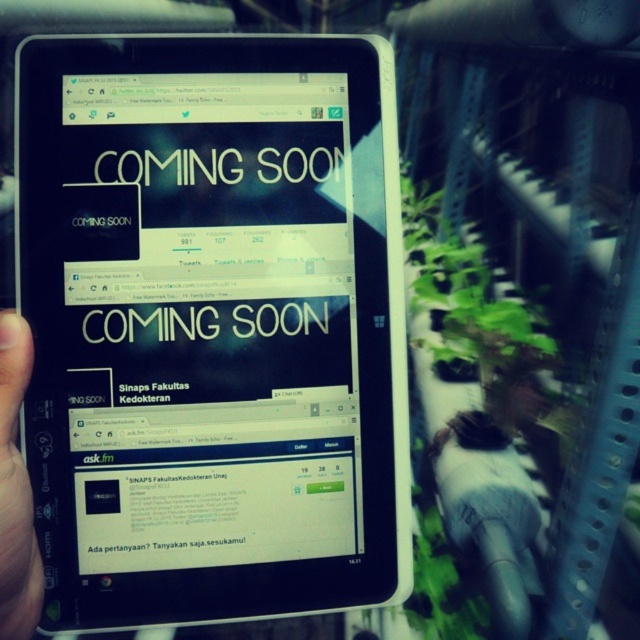
From the picture: You are a student trying to view both the black glossy tablet at center and the black matte tablet at left. Which tablet should you move closer to in order to see the details better?

You should move closer to the black glossy tablet at center because it is already closer to you than the black matte tablet at left, so it will be easier to see the details without straining.

You are a student trying to access the Sinaps Faculty of Medicine website on your black glossy tablet at center. The tablet is positioned at point coordinates of [212,324]. If you move your hand 0.1 units to the right from the tablet, will you be pointing towards the plants in the greenhouse background?

The point coordinates of [212,324] correspond to the black glossy tablet at center. Moving 0.1 units to the right would place your hand at approximately 0.609, 0.333. Since the plants in the greenhouse background are located to the right of the tablet, moving your hand 0.1 units to the right would indeed point towards the plants in the greenhouse background.

You are organizing a presentation about the Sinaps Faculty of Medicine. You have two tablets in the image, a black glossy tablet at center and a black matte tablet at left. Which tablet should you use to display the COMING SOON webpage if you want it to be more visible to the audience?

The black glossy tablet at center should be used because it is positioned above the black matte tablet at left, making it more visible to the audience.